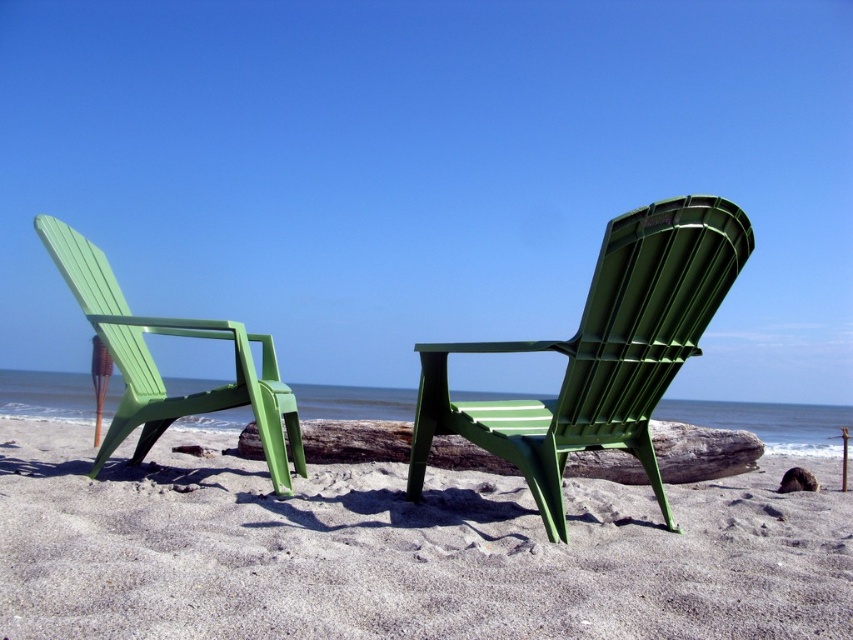
Question: Which point is closer to the camera taking this photo?

Choices:
 (A) (320, 461)
 (B) (828, 628)
 (C) (287, 388)
 (D) (602, 371)

Answer: (B)

Question: Which is farther from the sandy beige sand at center?

Choices:
 (A) wooden log at center
 (B) matte green plastic beach chair at left
 (C) green plastic beach chair at center

Answer: (A)

Question: From the image, what is the correct spatial relationship of green plastic beach chair at center in relation to matte green plastic beach chair at left?

Choices:
 (A) above
 (B) below

Answer: (B)

Question: Can you confirm if matte green plastic beach chair at left is positioned to the left of wooden log at center?

Choices:
 (A) no
 (B) yes

Answer: (B)

Question: Can you confirm if sandy beige sand at center is positioned to the right of green plastic beach chair at center?

Choices:
 (A) no
 (B) yes

Answer: (A)

Question: Which object is positioned closest to the matte green plastic beach chair at left?

Choices:
 (A) sandy beige sand at center
 (B) wooden log at center

Answer: (A)